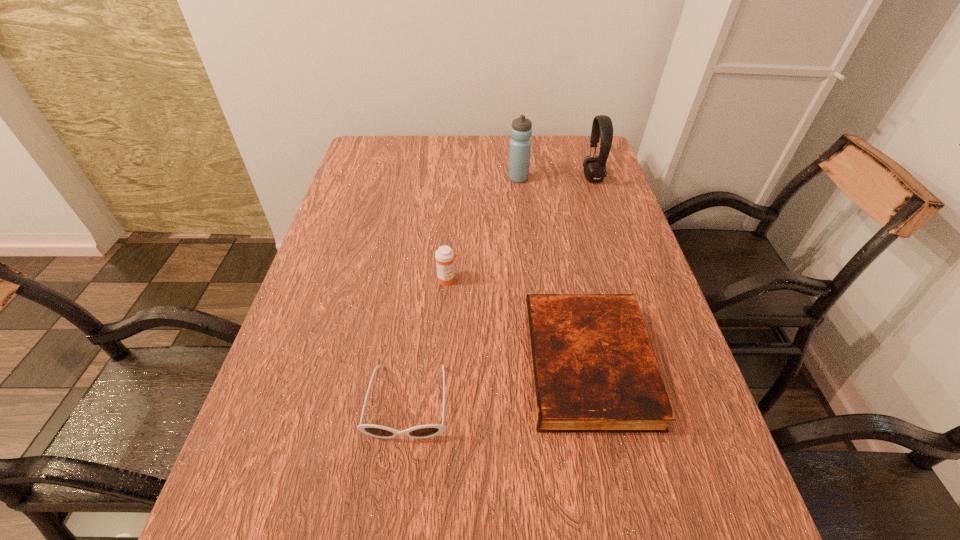
Image resolution: width=960 pixels, height=540 pixels. I want to click on free space between the Bible and the third nearest object, so click(518, 322).

Locate an element on the screen. The image size is (960, 540). free space between the headset and the sunglasses is located at coordinates (500, 290).

Find the location of a particular element. The width and height of the screenshot is (960, 540). free space between the headset and the medicine is located at coordinates (520, 229).

The width and height of the screenshot is (960, 540). Find the location of `vacant space that is in between the sunglasses and the medicine`. vacant space that is in between the sunglasses and the medicine is located at coordinates (428, 341).

Locate which object ranks third in proximity to the headset. Please provide its 2D coordinates. Your answer should be formatted as a tuple, i.e. [(x, y)], where the tuple contains the x and y coordinates of a point satisfying the conditions above.

[(444, 255)]

The image size is (960, 540). In order to click on the third closest object to the headset in this screenshot , I will do `click(444, 255)`.

The height and width of the screenshot is (540, 960). Identify the location of free region that satisfies the following two spatial constraints: 1. on the front-facing side of the headset; 2. with the lenses of the sunglasses facing outward. (667, 402).

At what (x,y) coordinates should I click in order to perform the action: click on vacant space that satisfies the following two spatial constraints: 1. on the front-facing side of the headset; 2. on the front side of the water bottle. Please return your answer as a coordinate pair (x, y). Looking at the image, I should click on (593, 178).

The width and height of the screenshot is (960, 540). I want to click on free space that satisfies the following two spatial constraints: 1. on the front-facing side of the headset; 2. on the front side of the water bottle, so click(x=593, y=178).

Where is `free space that satisfies the following two spatial constraints: 1. on the front-facing side of the headset; 2. with the lenses of the sunglasses facing outward`? This screenshot has width=960, height=540. free space that satisfies the following two spatial constraints: 1. on the front-facing side of the headset; 2. with the lenses of the sunglasses facing outward is located at coordinates (667, 402).